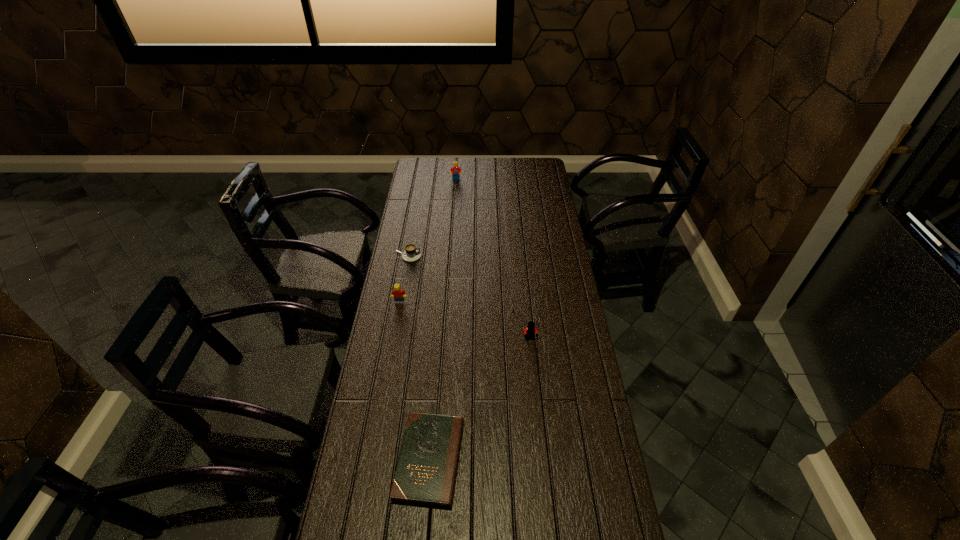
Identify the location of vacant space at the left edge of the desktop. (358, 505).

Locate an element on the screen. This screenshot has width=960, height=540. blank area at the right edge is located at coordinates (558, 388).

Locate an element on the screen. The width and height of the screenshot is (960, 540). unoccupied area between the farthest object and the third nearest object is located at coordinates (428, 241).

Find the location of a particular element. Image resolution: width=960 pixels, height=540 pixels. free spot between the second farthest object and the farthest Lego is located at coordinates (432, 218).

You are a GUI agent. You are given a task and a screenshot of the screen. Output one action in this format:
    pyautogui.click(x=<x>, y=<y>)
    Task: Click on the vacant space in between the fourth nearest object and the farthest Lego
    
    Given the screenshot: What is the action you would take?
    pyautogui.click(x=432, y=218)

The height and width of the screenshot is (540, 960). I want to click on free space between the rightmost Lego and the farthest Lego, so click(493, 259).

You are a GUI agent. You are given a task and a screenshot of the screen. Output one action in this format:
    pyautogui.click(x=<x>, y=<y>)
    Task: Click on the vacant area that lies between the farthest object and the cappuccino
    
    Given the screenshot: What is the action you would take?
    pyautogui.click(x=432, y=218)

The image size is (960, 540). I want to click on free space that is in between the fourth nearest object and the leftmost Lego, so click(x=404, y=279).

In order to click on unoccupied position between the farthest Lego and the fourth farthest object in this screenshot , I will do [x=493, y=259].

I want to click on empty space between the nearest Lego and the fourth nearest object, so 469,298.